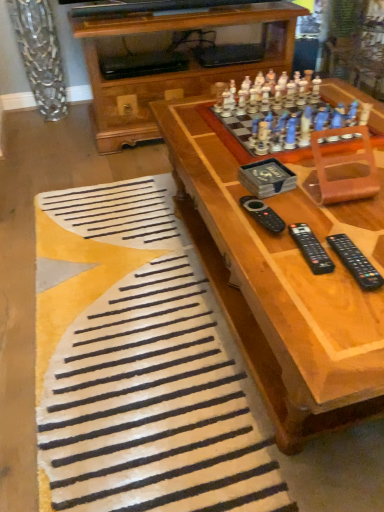
Locate an element on the screen. This screenshot has height=512, width=384. free space above white soft rug at lower center (from a real-world perspective) is located at coordinates (133, 302).